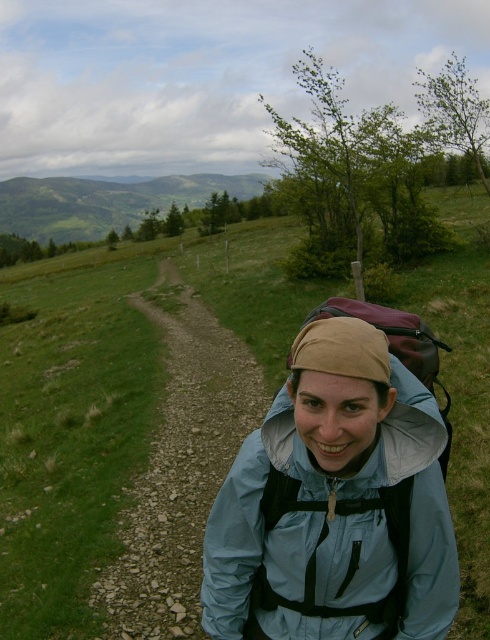
In the scene shown: Who is more forward, (x=231, y=568) or (x=18, y=209)?

Point (x=231, y=568) is in front.

Is point (388, 572) more distant than point (185, 189)?

No, (388, 572) is in front of (185, 189).

Which is behind, point (459, 586) or point (140, 211)?

Point (140, 211)

Where is `light blue waterproof jacket at center`? The height and width of the screenshot is (640, 490). light blue waterproof jacket at center is located at coordinates (335, 532).

Which is above, green grassy hillside at upper left or dark blue fabric backpack at center?

green grassy hillside at upper left is above.

Does green grassy hillside at upper left appear on the left side of dark blue fabric backpack at center?

Yes, green grassy hillside at upper left is to the left of dark blue fabric backpack at center.

Does point (79, 228) lie behind point (413, 337)?

That is True.

Find the location of a particular element. Image resolution: width=490 pixels, height=640 pixels. green grassy hillside at upper left is located at coordinates (105, 202).

Which is more to the right, light blue waterproof jacket at center or dark blue fabric backpack at center?

dark blue fabric backpack at center

Can you confirm if light blue waterproof jacket at center is positioned below dark blue fabric backpack at center?

Yes, light blue waterproof jacket at center is below dark blue fabric backpack at center.

Image resolution: width=490 pixels, height=640 pixels. Describe the element at coordinates (335, 532) in the screenshot. I see `light blue waterproof jacket at center` at that location.

This screenshot has width=490, height=640. I want to click on light blue waterproof jacket at center, so click(x=335, y=532).